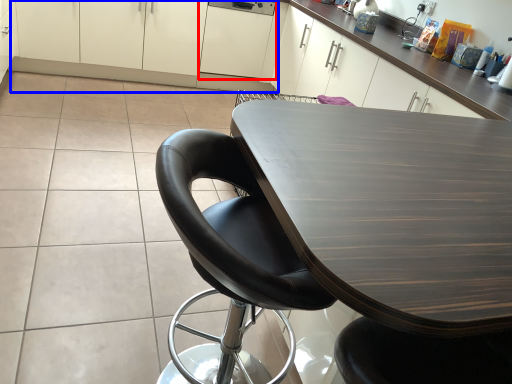
Question: Among these objects, which one is farthest to the camera, cabinetry (highlighted by a red box) or cabinetry (highlighted by a blue box)?

Choices:
 (A) cabinetry
 (B) cabinetry

Answer: (A)